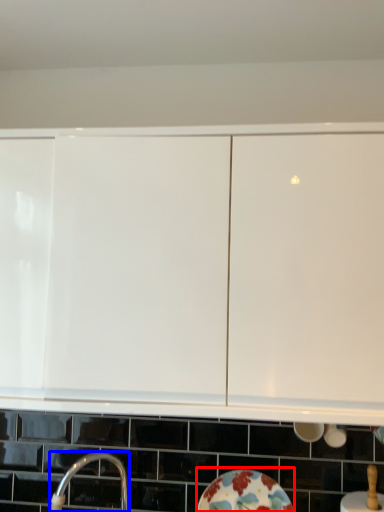
Question: Which of the following is the farthest to the observer, plate (highlighted by a red box) or tap (highlighted by a blue box)?

Choices:
 (A) plate
 (B) tap

Answer: (A)